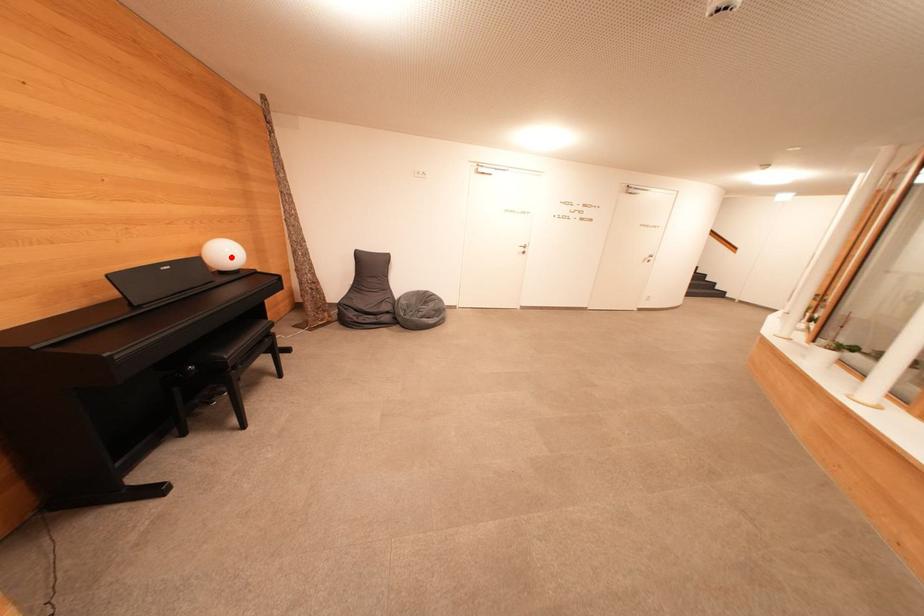
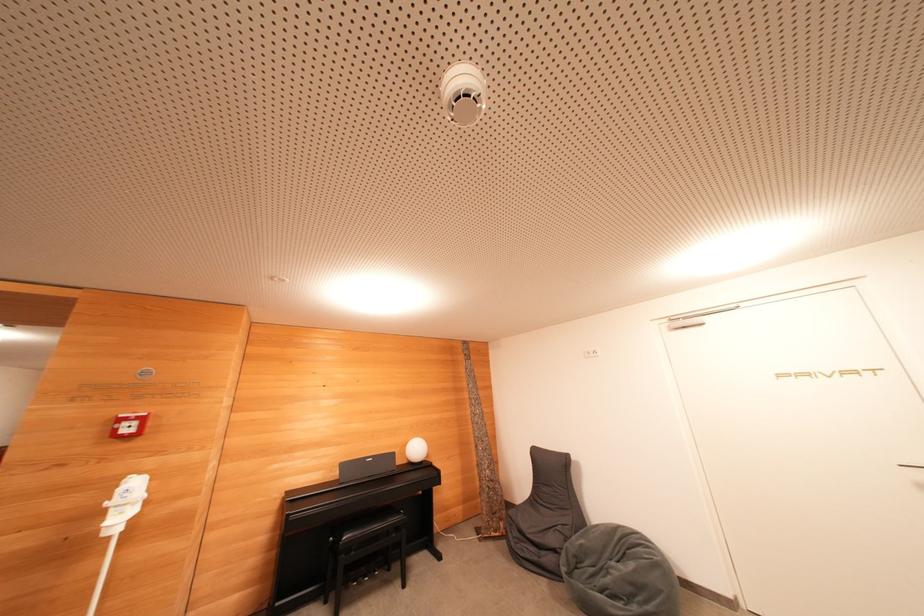
Question: I am providing you with two images of the same scene from different viewpoints. Given a red point in image1, look at the same physical point in image2. Is it:

Choices:
 (A) Closer to the viewpoint
 (B) Farther from the viewpoint

Answer: (B)